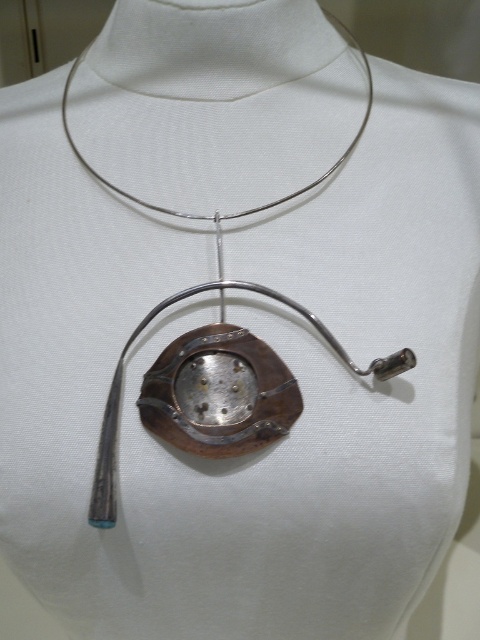
Question: In this image, where is rusty metal pendant at center located relative to polished silver pendant at center?

Choices:
 (A) below
 (B) above

Answer: (A)

Question: Is rusty metal pendant at center wider than polished silver pendant at center?

Choices:
 (A) no
 (B) yes

Answer: (A)

Question: Which point appears farthest from the camera in this image?

Choices:
 (A) (402, 371)
 (B) (231, 385)

Answer: (B)

Question: Is rusty metal pendant at center below polished silver pendant at center?

Choices:
 (A) no
 (B) yes

Answer: (B)

Question: Which object appears closest to the camera in this image?

Choices:
 (A) polished silver pendant at center
 (B) rusty metal pendant at center

Answer: (A)